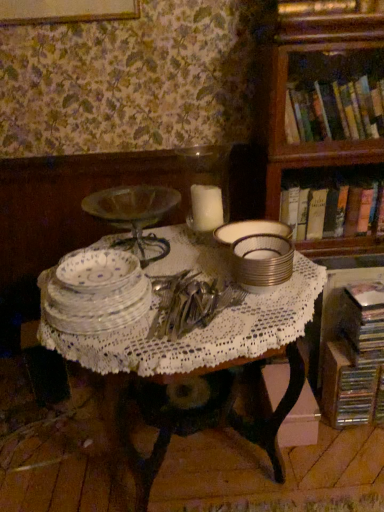
Locate an element on the screen. The width and height of the screenshot is (384, 512). vacant space that is to the left of silver metallic stack at center, the second tableware viewed from the left is located at coordinates (222, 303).